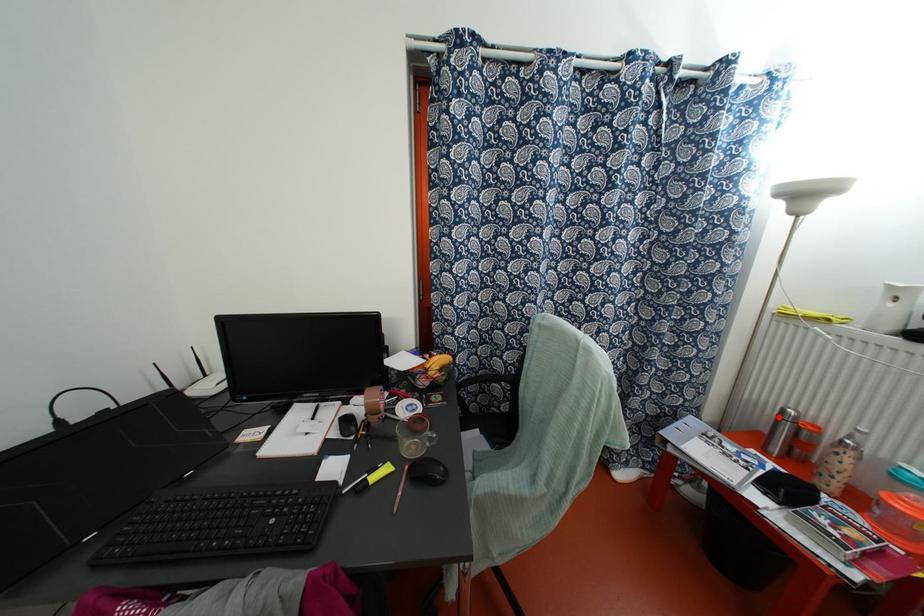
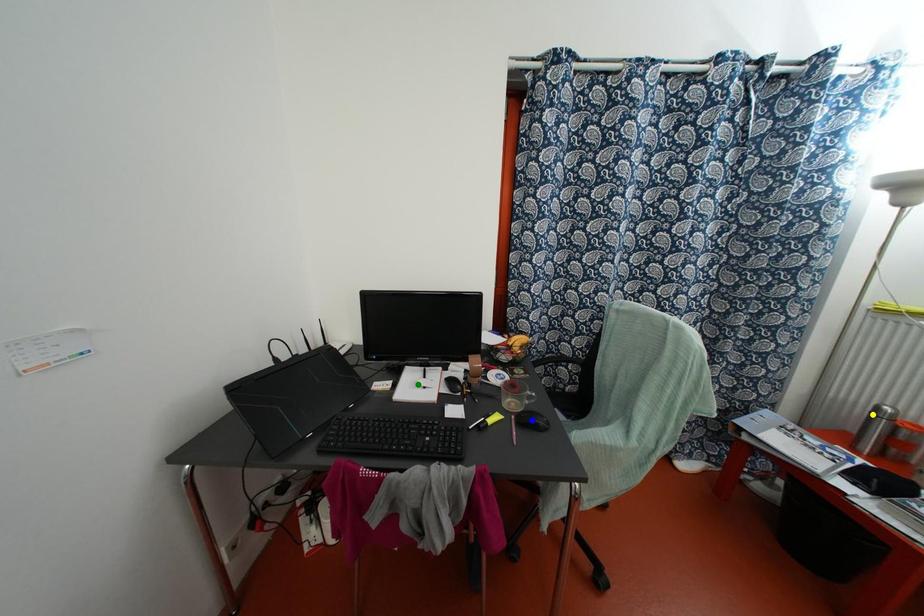
Question: I am providing you with two images of the same scene from different viewpoints. A red point is marked on the first image. You are given multiple points on the second image. In image 2, which mark is for the same physical point as the one in image 1?

Choices:
 (A) yellow point
 (B) blue point
 (C) green point

Answer: (A)